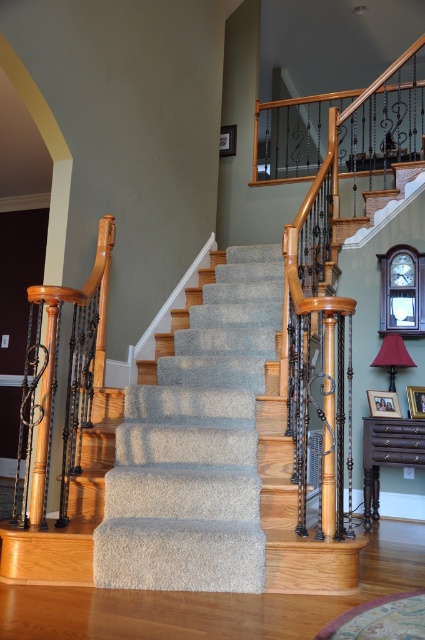
Question: Does carpeted stairs at center have a greater width compared to matte red lampshade at right?

Choices:
 (A) yes
 (B) no

Answer: (A)

Question: Which point appears closest to the camera in this image?

Choices:
 (A) (331, 442)
 (B) (393, 360)

Answer: (A)

Question: Which object is closer to the camera taking this photo?

Choices:
 (A) matte red lampshade at right
 (B) carpeted stairs at center

Answer: (B)

Question: Which point is farther from the camera taking this photo?

Choices:
 (A) (402, 344)
 (B) (331, 365)

Answer: (A)

Question: Is carpeted stairs at center positioned behind matte red lampshade at right?

Choices:
 (A) yes
 (B) no

Answer: (B)

Question: Is carpeted stairs at center closer to camera compared to matte red lampshade at right?

Choices:
 (A) no
 (B) yes

Answer: (B)